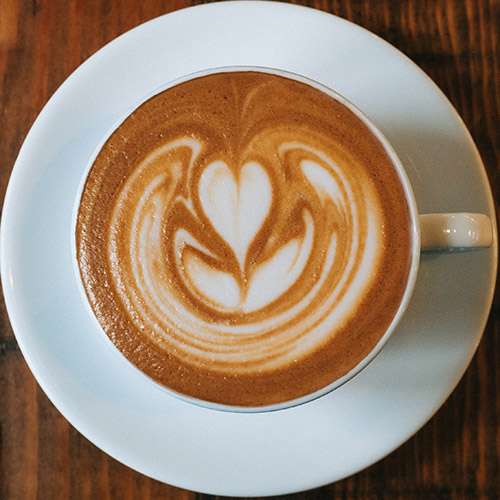
Identify the location of foam. This screenshot has height=500, width=500. (227, 197), (249, 205), (275, 291), (217, 288), (207, 331), (219, 350), (299, 346).